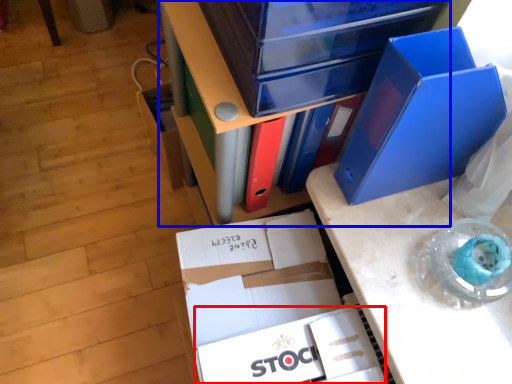
Question: Which of the following is the farthest to the observer, paperback book (highlighted by a red box) or furniture (highlighted by a blue box)?

Choices:
 (A) paperback book
 (B) furniture

Answer: (A)